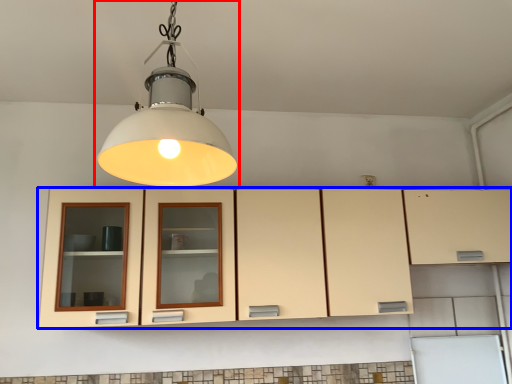
Question: Which object is closer to the camera taking this photo, lamp (highlighted by a red box) or cabinetry (highlighted by a blue box)?

Choices:
 (A) lamp
 (B) cabinetry

Answer: (A)